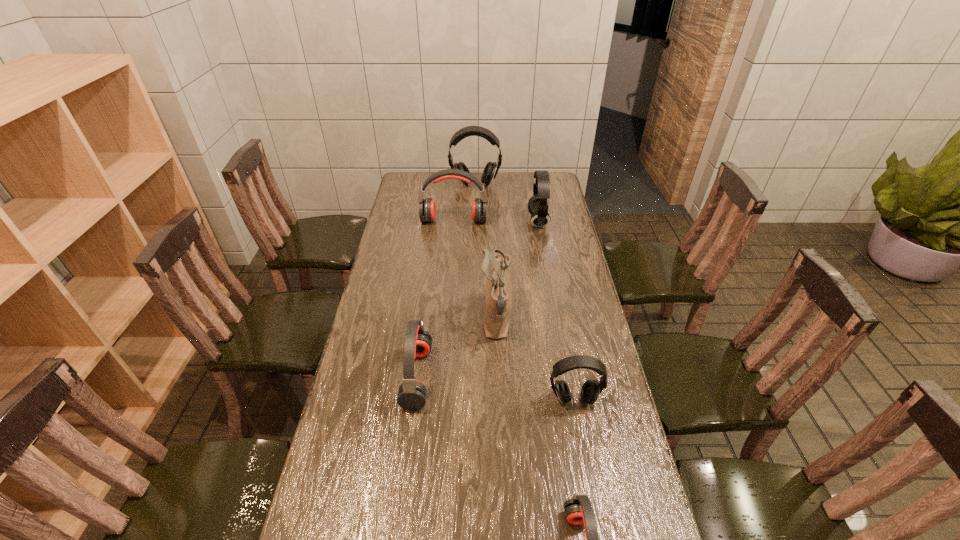
Find the location of a particular element. Image resolution: width=960 pixels, height=540 pixels. the farthest black earphone is located at coordinates (491, 169).

Identify the location of the farthest earphone. (491, 169).

Locate an element on the screen. The height and width of the screenshot is (540, 960). tan shoulder bag is located at coordinates (498, 297).

Locate an element on the screen. The image size is (960, 540). the farthest red earphone is located at coordinates (427, 212).

Where is `the second biggest black earphone`? the second biggest black earphone is located at coordinates (538, 206).

Identify the location of the second smallest red earphone. Image resolution: width=960 pixels, height=540 pixels. (412, 393).

I want to click on the smallest black earphone, so click(x=590, y=391).

Locate an element on the screen. This screenshot has height=540, width=960. blank space located on the ear cups of the farthest earphone is located at coordinates (475, 208).

Locate an element on the screen. free location located 0.330m on the front-facing side of the tan shoulder bag is located at coordinates pyautogui.click(x=387, y=319).

Locate an element on the screen. Image resolution: width=960 pixels, height=540 pixels. free region located 0.150m on the front-facing side of the tan shoulder bag is located at coordinates click(x=438, y=319).